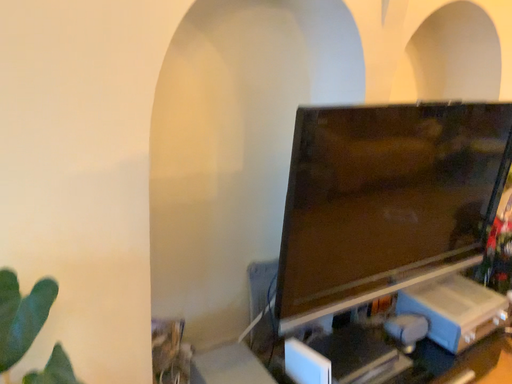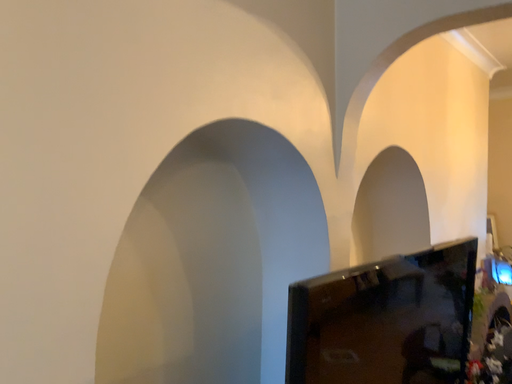
Question: Which way did the camera rotate in the video?

Choices:
 (A) rotated right
 (B) rotated left

Answer: (A)